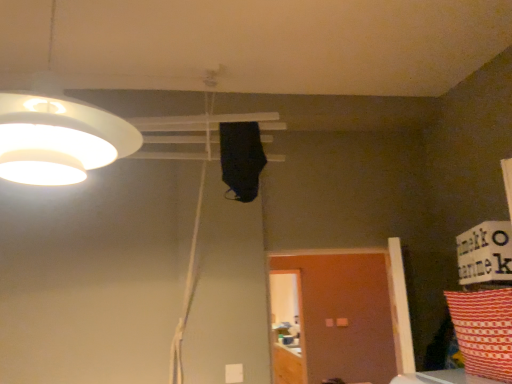
Question: Does white matte lampshade at upper left have a lesser width compared to red and white patterned pillow at lower right?

Choices:
 (A) yes
 (B) no

Answer: (B)

Question: Would you say white matte lampshade at upper left is a long distance from red and white patterned pillow at lower right?

Choices:
 (A) yes
 (B) no

Answer: (A)

Question: From a real-world perspective, is white matte lampshade at upper left on top of red and white patterned pillow at lower right?

Choices:
 (A) yes
 (B) no

Answer: (A)

Question: Is white matte lampshade at upper left wider than red and white patterned pillow at lower right?

Choices:
 (A) no
 (B) yes

Answer: (B)

Question: Considering the relative positions of white matte lampshade at upper left and red and white patterned pillow at lower right in the image provided, is white matte lampshade at upper left to the right of red and white patterned pillow at lower right from the viewer's perspective?

Choices:
 (A) no
 (B) yes

Answer: (A)

Question: From a real-world perspective, is white matte lampshade at upper left beneath red and white patterned pillow at lower right?

Choices:
 (A) no
 (B) yes

Answer: (A)

Question: Does white matte lampshade at upper left touch brown matte door at lower right?

Choices:
 (A) yes
 (B) no

Answer: (B)

Question: Is white matte lampshade at upper left taller than brown matte door at lower right?

Choices:
 (A) yes
 (B) no

Answer: (B)

Question: Can we say white matte lampshade at upper left lies outside brown matte door at lower right?

Choices:
 (A) yes
 (B) no

Answer: (A)

Question: Is white matte lampshade at upper left thinner than brown matte door at lower right?

Choices:
 (A) yes
 (B) no

Answer: (B)

Question: Does white matte lampshade at upper left come behind brown matte door at lower right?

Choices:
 (A) no
 (B) yes

Answer: (A)

Question: Can you confirm if white matte lampshade at upper left is wider than brown matte door at lower right?

Choices:
 (A) no
 (B) yes

Answer: (B)

Question: Considering the relative positions of brown matte door at lower right and red and white patterned pillow at lower right in the image provided, is brown matte door at lower right to the left of red and white patterned pillow at lower right from the viewer's perspective?

Choices:
 (A) yes
 (B) no

Answer: (A)